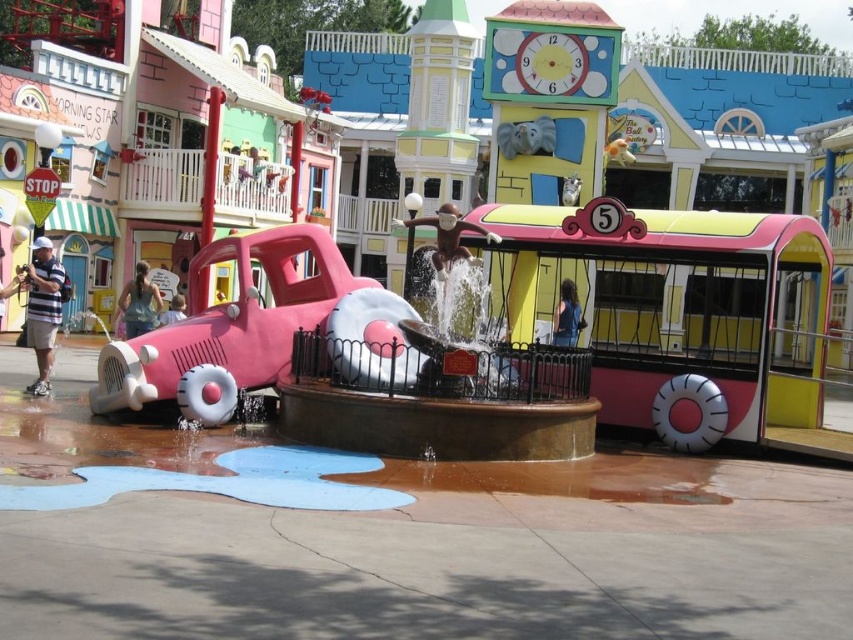
Question: Which of the following is the farthest from the observer?

Choices:
 (A) (166, 152)
 (B) (579, 312)
 (C) (160, 321)

Answer: (A)

Question: Considering the real-world distances, which object is closest to the denim jacket at lower left?

Choices:
 (A) matte pink car at center
 (B) light blue shirt at center

Answer: (B)

Question: Considering the relative positions of pink rubber car at center and light blue shirt at center in the image provided, where is pink rubber car at center located with respect to light blue shirt at center?

Choices:
 (A) left
 (B) right

Answer: (B)

Question: From the image, what is the correct spatial relationship of pink rubber car at center in relation to blue denim jacket at center?

Choices:
 (A) below
 (B) above

Answer: (A)

Question: Is matte pink car at center to the right of denim jacket at lower left from the viewer's perspective?

Choices:
 (A) no
 (B) yes

Answer: (B)

Question: Which point is closer to the camera?

Choices:
 (A) matte pink car at center
 (B) light blue shirt at center

Answer: (A)